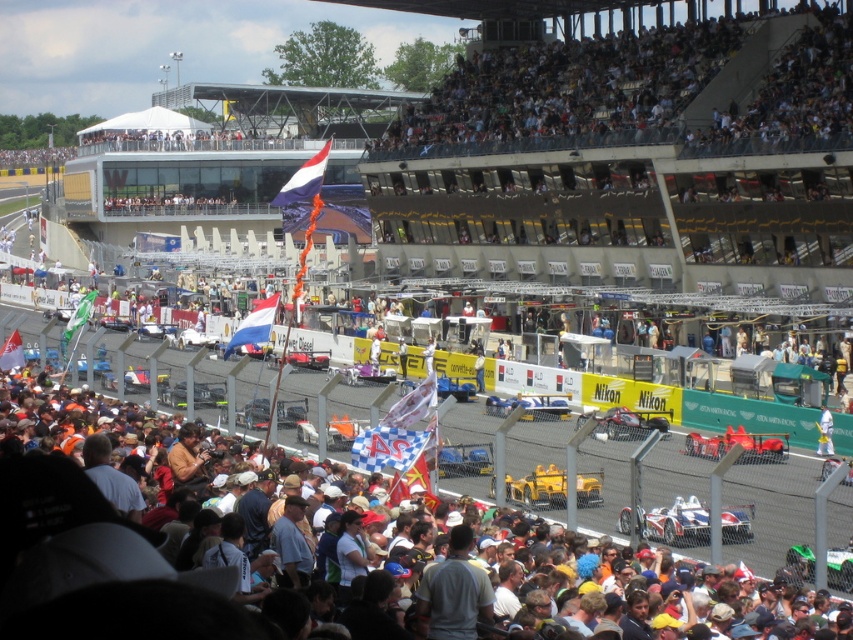
Is point (537, 419) positioned in front of point (819, 433)?

Yes, point (537, 419) is closer to viewer.

Is white matte race car at center further to the viewer compared to white fabric person at lower right?

No.

Which is behind, point (529, 404) or point (830, 422)?

The point (529, 404) is more distant.

Locate an element on the screen. white matte race car at center is located at coordinates (531, 404).

Does green matte race car at lower right have a greater width compared to white fabric person at lower right?

Yes, green matte race car at lower right is wider than white fabric person at lower right.

Does green matte race car at lower right appear under white fabric person at lower right?

Yes.

Locate an element on the screen. The image size is (853, 640). green matte race car at lower right is located at coordinates (839, 568).

Which is below, shiny red race car at center or green matte race car at lower right?

green matte race car at lower right

Which of these two, shiny red race car at center or green matte race car at lower right, stands shorter?

With less height is shiny red race car at center.

Identify the location of shiny red race car at center. This screenshot has height=640, width=853. pyautogui.click(x=740, y=444).